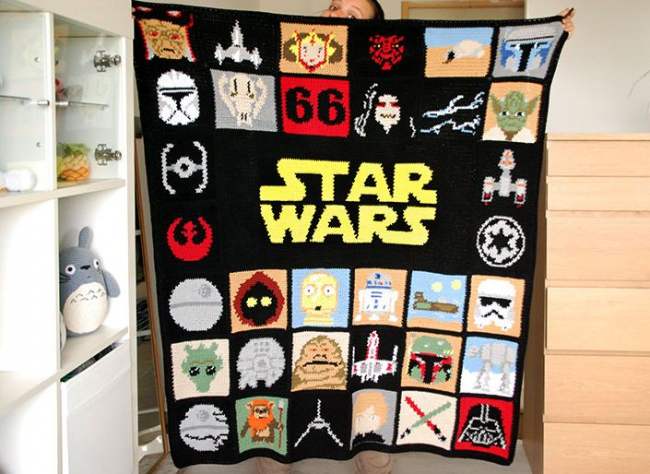
At what (x,y) coordinates should I click in order to perform the action: click on blanket. Please return your answer as a coordinate pair (x, y). This screenshot has height=474, width=650. Looking at the image, I should click on (448, 269).